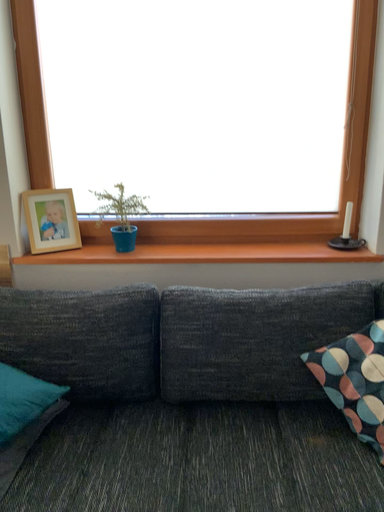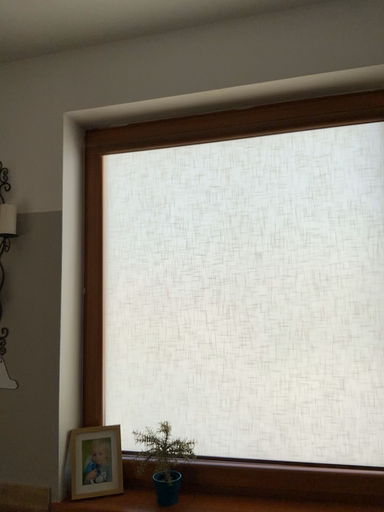
Question: How did the camera likely rotate when shooting the video?

Choices:
 (A) rotated downward
 (B) rotated upward

Answer: (B)